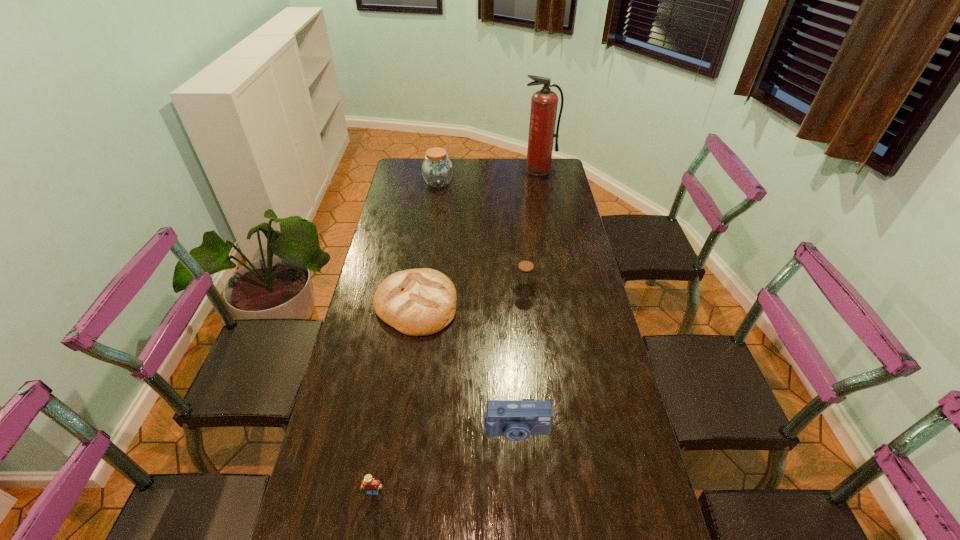
Where is `object that is at the right edge`? The image size is (960, 540). object that is at the right edge is located at coordinates (544, 103).

At what (x,y) coordinates should I click in order to perform the action: click on object that is positioned at the far left corner. Please return your answer as a coordinate pair (x, y). The width and height of the screenshot is (960, 540). Looking at the image, I should click on (437, 170).

Find the location of a particular element. Image resolution: width=960 pixels, height=540 pixels. object positioned at the far right corner is located at coordinates (544, 103).

The width and height of the screenshot is (960, 540). Identify the location of vacant space at the far edge of the desktop. (464, 167).

What are the coordinates of `blank space at the left edge of the desktop` in the screenshot? It's located at (374, 408).

I want to click on vacant area at the right edge of the desktop, so click(x=603, y=371).

Image resolution: width=960 pixels, height=540 pixels. In order to click on free space at the far left corner in this screenshot , I will do `click(419, 168)`.

Where is `vacant space at the far right corner of the desktop`? The height and width of the screenshot is (540, 960). vacant space at the far right corner of the desktop is located at coordinates (561, 167).

At what (x,y) coordinates should I click in order to perform the action: click on vacant space that is in between the second tallest object and the bread. Please return your answer as a coordinate pair (x, y). The width and height of the screenshot is (960, 540). Looking at the image, I should click on (427, 244).

The height and width of the screenshot is (540, 960). In order to click on free space between the second nearest object and the rightmost object in this screenshot , I will do `click(527, 300)`.